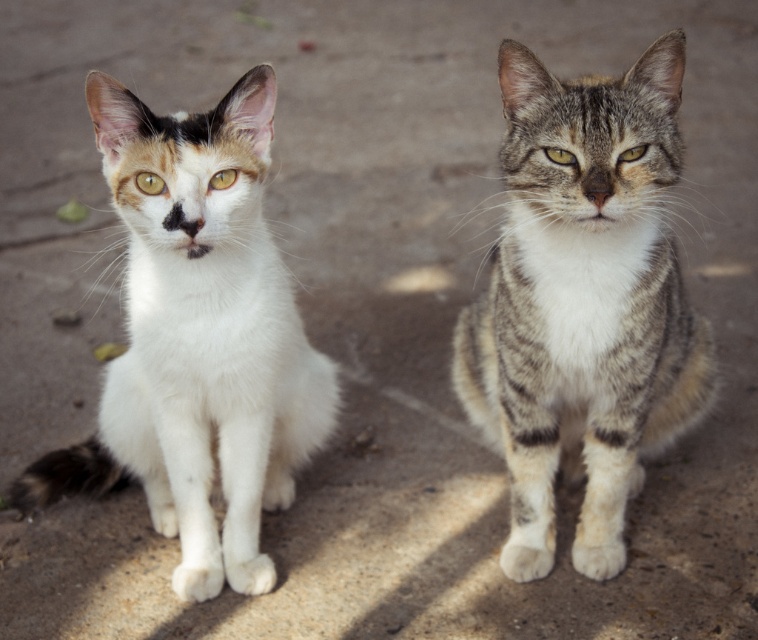
Question: Does tabby fur cat at center have a smaller size compared to white soft fur cat at left?

Choices:
 (A) no
 (B) yes

Answer: (B)

Question: Where is tabby fur cat at center located in relation to white soft fur cat at left in the image?

Choices:
 (A) left
 (B) right

Answer: (B)

Question: Which of the following is the farthest from the observer?

Choices:
 (A) tabby fur cat at center
 (B) white soft fur cat at left

Answer: (A)

Question: Which point appears farthest from the camera in this image?

Choices:
 (A) (522, 285)
 (B) (211, 564)

Answer: (B)

Question: Is tabby fur cat at center smaller than white soft fur cat at left?

Choices:
 (A) no
 (B) yes

Answer: (B)